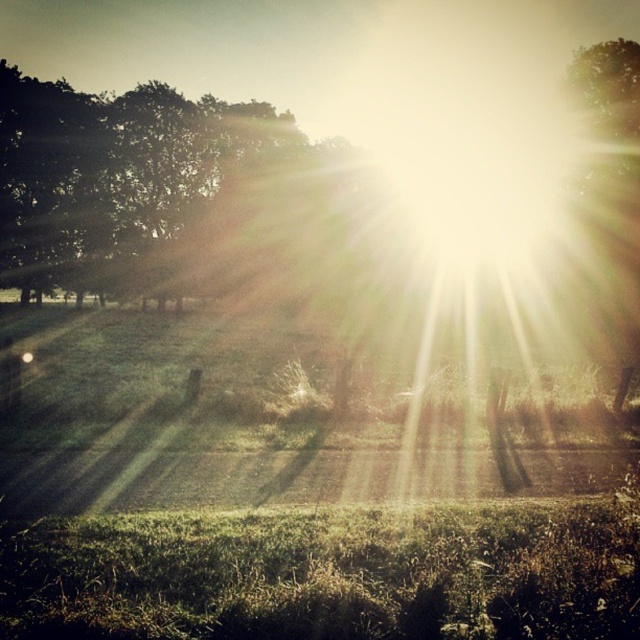
Looking at this image, based on the scene description, where is the green leafy tree at upper left located in terms of coordinates?

The green leafy tree at upper left is located at coordinates point (109, 173).

You are standing in the middle of the grassy area and looking towards the fence. Which tree, the green leafy tree at upper left or the green leafy tree at upper right, is closer to you?

The green leafy tree at upper left is closer to you because it is in front of the green leafy tree at upper right, which is behind it.

Looking at this image, you are a landscape architect designing a walking path between the green leafy tree at upper left and the green leafy tree at upper right. What is the minimum length the path should be to ensure it connects both trees?

The green leafy tree at upper left and green leafy tree at upper right are 43.62 meters apart, so the minimum length of the path should be at least 43.62 meters to directly connect both trees.